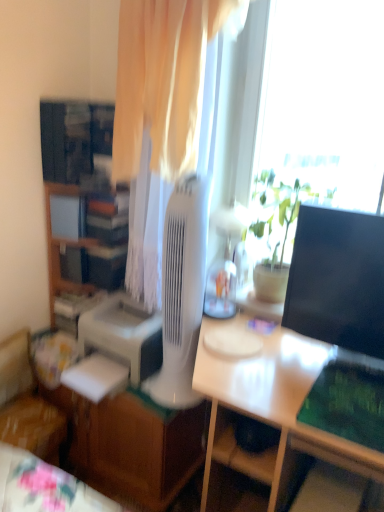
Where is `vacant location below black glossy monitor at right (from a real-world perspective)`? This screenshot has width=384, height=512. vacant location below black glossy monitor at right (from a real-world perspective) is located at coordinates (321, 357).